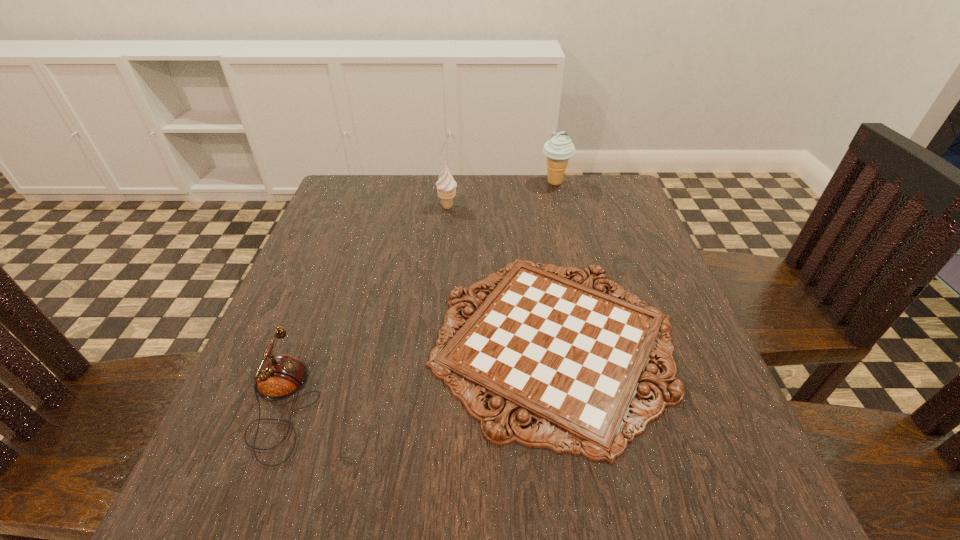
Locate an element on the screen. free space located on the front of the shortest object is located at coordinates (581, 510).

Locate an element on the screen. Image resolution: width=960 pixels, height=540 pixels. telephone located at the near edge is located at coordinates (279, 377).

Where is `chessboard that is at the near edge`? The height and width of the screenshot is (540, 960). chessboard that is at the near edge is located at coordinates (561, 352).

This screenshot has height=540, width=960. In order to click on object present at the left edge in this screenshot , I will do `click(279, 377)`.

What are the coordinates of `icecream located in the right edge section of the desktop` in the screenshot? It's located at (559, 149).

This screenshot has height=540, width=960. Identify the location of chessboard that is at the right edge. (561, 352).

What are the coordinates of `object situated at the near left corner` in the screenshot? It's located at (279, 377).

The image size is (960, 540). Identify the location of object present at the far right corner. (559, 149).

Image resolution: width=960 pixels, height=540 pixels. Find the location of `object that is at the near right corner`. object that is at the near right corner is located at coordinates (561, 352).

In the image, there is a desktop. In order to click on vacant region at the far edge in this screenshot , I will do `click(513, 200)`.